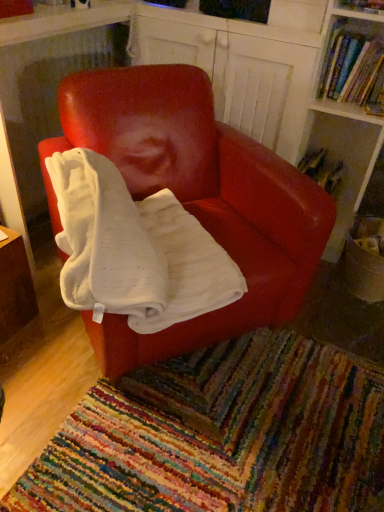
Question: Is hardcover book at upper right, which is counted as the second book, starting from the bottom, far from hardcover book at upper right, which is counted as the 2th book, starting from the front?

Choices:
 (A) yes
 (B) no

Answer: (B)

Question: Does hardcover book at upper right, which is counted as the second book, starting from the bottom, contain hardcover book at upper right, the 1th book in the back-to-front sequence?

Choices:
 (A) no
 (B) yes

Answer: (A)

Question: Considering the relative sizes of hardcover book at upper right, which is counted as the second book, starting from the bottom, and hardcover book at upper right, which is counted as the 2th book, starting from the front, in the image provided, is hardcover book at upper right, which is counted as the second book, starting from the bottom, smaller than hardcover book at upper right, which is counted as the 2th book, starting from the front,?

Choices:
 (A) yes
 (B) no

Answer: (B)

Question: Considering the relative sizes of hardcover book at upper right, the first book from the front, and hardcover book at upper right, which is the 2th book from top to bottom, in the image provided, is hardcover book at upper right, the first book from the front, bigger than hardcover book at upper right, which is the 2th book from top to bottom,?

Choices:
 (A) no
 (B) yes

Answer: (B)

Question: Considering the relative positions of hardcover book at upper right, acting as the second book starting from the back, and hardcover book at upper right, which is the 2th book from top to bottom, in the image provided, is hardcover book at upper right, acting as the second book starting from the back, to the right of hardcover book at upper right, which is the 2th book from top to bottom, from the viewer's perspective?

Choices:
 (A) yes
 (B) no

Answer: (A)

Question: Considering the relative sizes of hardcover book at upper right, acting as the 1th book starting from the top, and hardcover book at upper right, which is counted as the 2th book, starting from the front, in the image provided, is hardcover book at upper right, acting as the 1th book starting from the top, wider than hardcover book at upper right, which is counted as the 2th book, starting from the front,?

Choices:
 (A) yes
 (B) no

Answer: (B)

Question: Is hardcover book at upper right, which is the 2th book from top to bottom, at the left side of hardcover book at upper right, the first book from the front?

Choices:
 (A) no
 (B) yes

Answer: (B)

Question: Considering the relative sizes of hardcover book at upper right, which is counted as the first book, starting from the bottom, and hardcover book at upper right, the first book from the front, in the image provided, is hardcover book at upper right, which is counted as the first book, starting from the bottom, shorter than hardcover book at upper right, the first book from the front,?

Choices:
 (A) yes
 (B) no

Answer: (A)

Question: Is there a large distance between hardcover book at upper right, which is the 2th book from top to bottom, and hardcover book at upper right, acting as the 1th book starting from the top?

Choices:
 (A) no
 (B) yes

Answer: (A)

Question: Is hardcover book at upper right, which is the 2th book from top to bottom, facing towards hardcover book at upper right, the first book from the front?

Choices:
 (A) yes
 (B) no

Answer: (B)

Question: Does hardcover book at upper right, which is the 2th book from top to bottom, contain hardcover book at upper right, which is counted as the second book, starting from the bottom?

Choices:
 (A) yes
 (B) no

Answer: (B)

Question: Is hardcover book at upper right, which is the 2th book from top to bottom, turned away from hardcover book at upper right, which is counted as the second book, starting from the bottom?

Choices:
 (A) no
 (B) yes

Answer: (A)

Question: Does multicolored woven mat at lower center have a greater width compared to matte red chair at center?

Choices:
 (A) yes
 (B) no

Answer: (A)